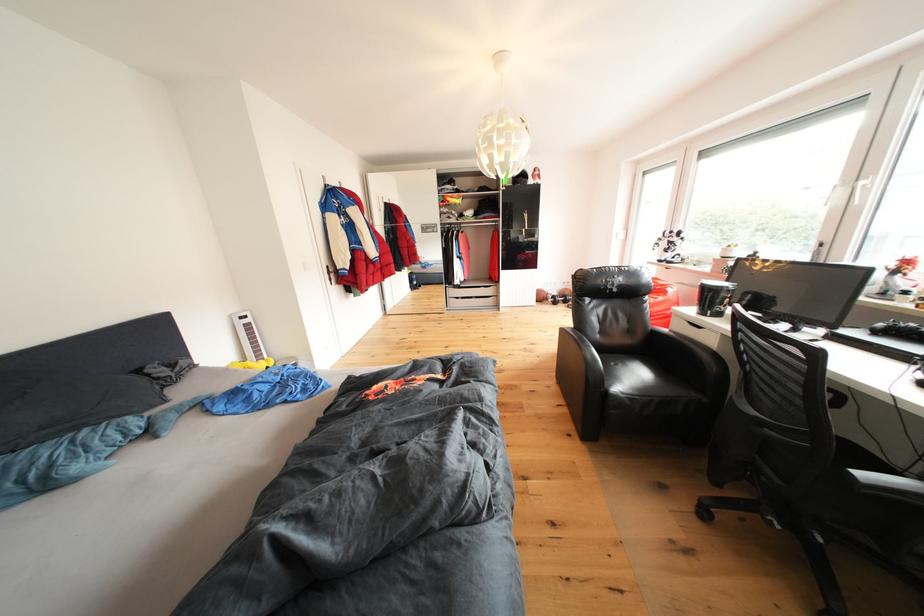
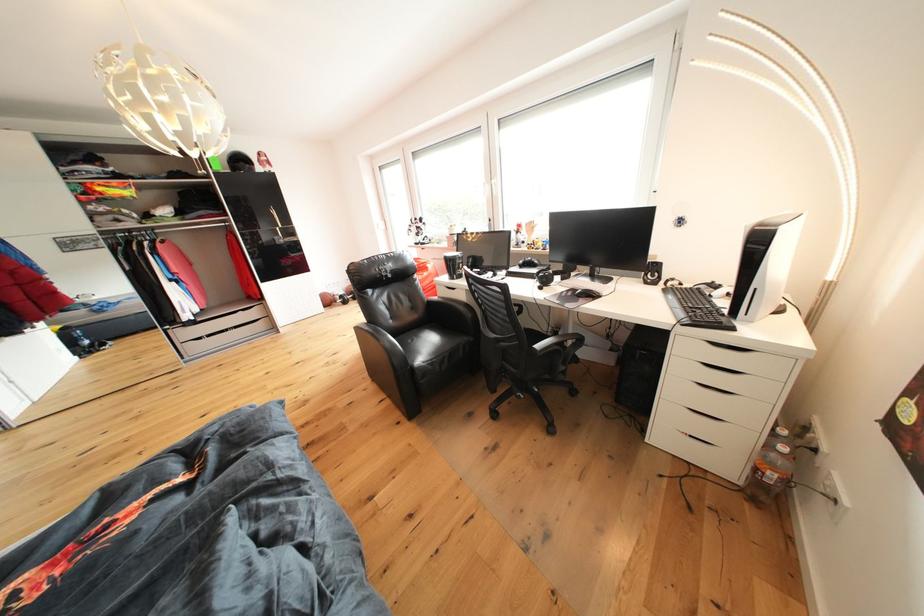
Question: The camera is either moving clockwise (left) or counter-clockwise (right) around the object. The first image is from the beginning of the video and the second image is from the end. Is the camera moving left or right when shooting the video?

Choices:
 (A) Left
 (B) Right

Answer: (A)